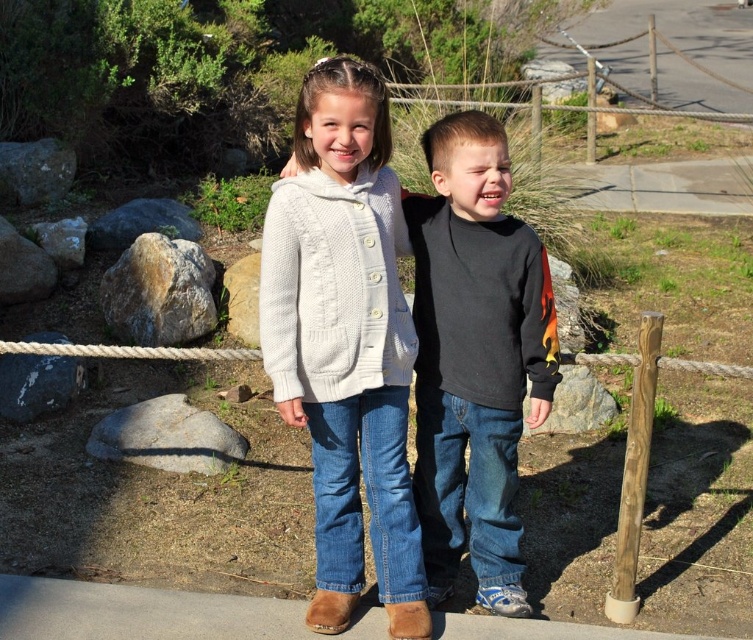
You are a photographer trying to capture a clear shot of the white knitted cardigan at center and the white rope at center. Which object will appear closer to the camera in the photo?

The white knitted cardigan at center will appear closer to the camera in the photo because it is in front of the white rope at center.

You are a photographer setting up a tripod at point 0.5, 0.5. You want to capture a clear shot of the white knitted cardigan at center. Is the cardigan within the camera frame centered at 0.5, 0.5 with a radius of 0.1?

The white knitted cardigan at center is at point (345, 342). The distance from the center (376, 320) is sqrt of squared differences. The maximum distance allowed is 0.1. Since sqrt of 0.036 squared plus 0.041 squared is sqrt of 0.001296 plus 0.001681 equals sqrt of 0.002977 which is approximately 0.0545, which is less than 0.1. Therefore, the cardigan is within the frame.